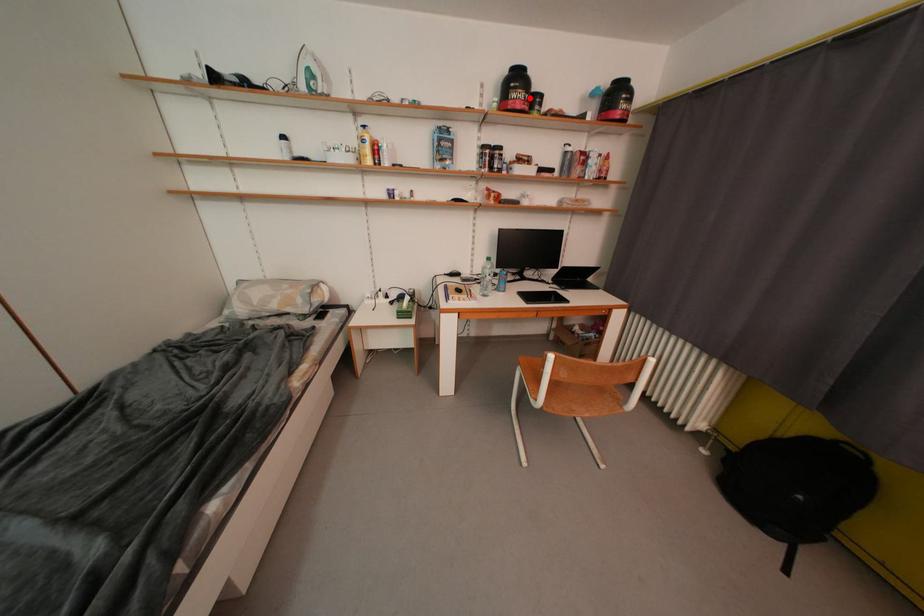
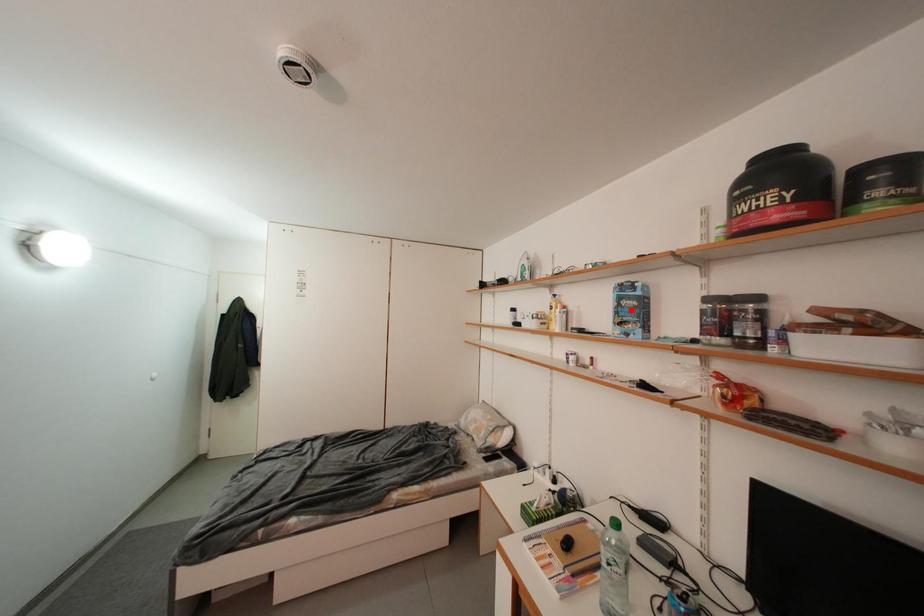
In the scene shown: I am providing you with two images of the same scene from different viewpoints. A red point is marked on the first image and another point is marked on the second image. Are the points marked in image1 and image2 representing the same 3D position?

No